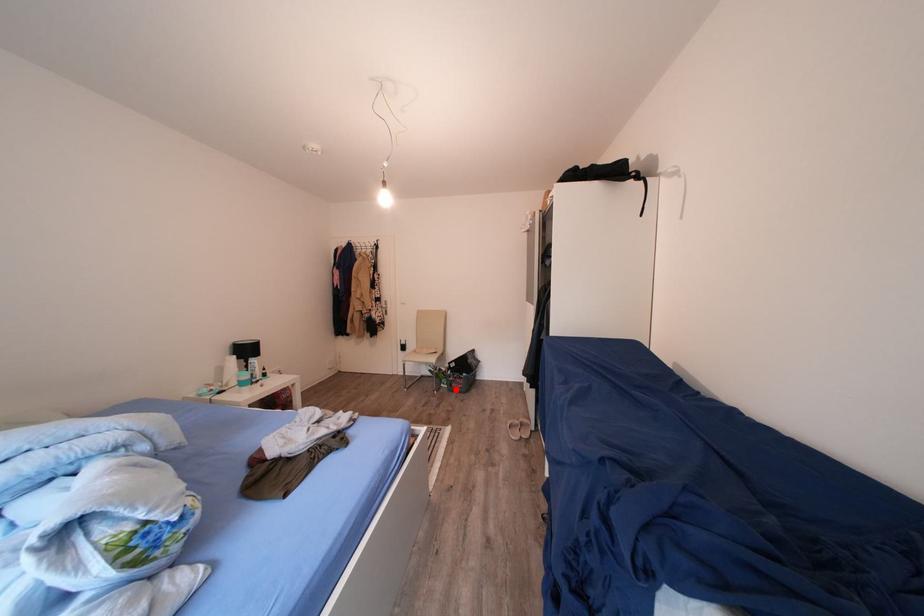
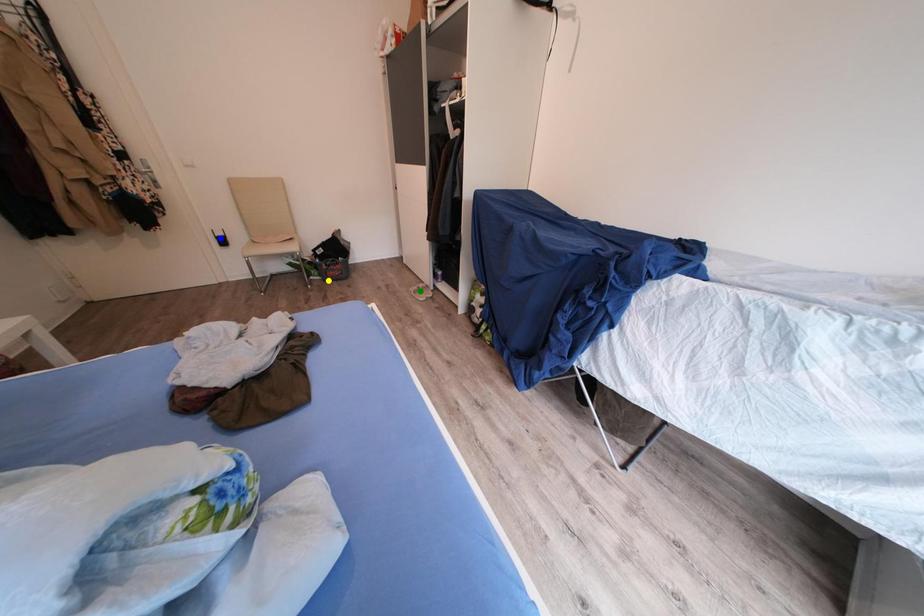
Question: I am providing you with two images of the same scene from different viewpoints. A red point is marked on the first image. You are given multiple points on the second image. In image 2, which mark is for the same physical point as the one in image 1?

Choices:
 (A) yellow point
 (B) green point
 (C) blue point

Answer: (A)